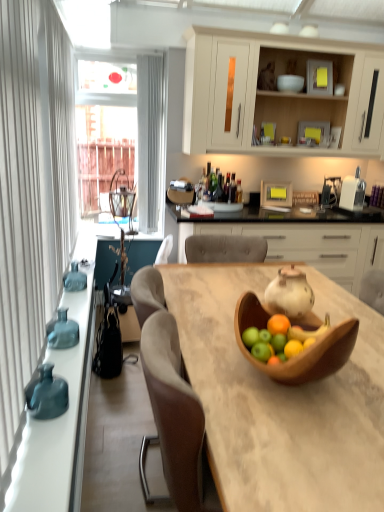
This screenshot has height=512, width=384. In order to click on empty space that is ontop of wooden table at center (from a real-world perspective) in this screenshot , I will do `click(230, 317)`.